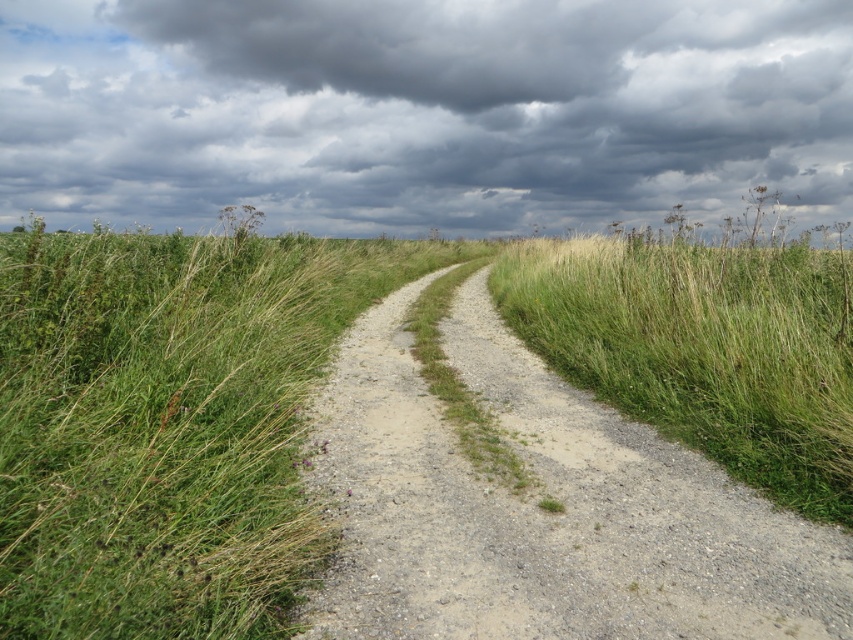
Question: Among these objects, which one is farthest from the camera?

Choices:
 (A) dark gray cloud at upper center
 (B) dusty gravel path at center

Answer: (A)

Question: Which of the following is the closest to the observer?

Choices:
 (A) (700, 125)
 (B) (704, 483)

Answer: (B)

Question: Is dark gray cloud at upper center wider than dusty gravel path at center?

Choices:
 (A) yes
 (B) no

Answer: (A)

Question: Which point appears closest to the camera in this image?

Choices:
 (A) (262, 202)
 (B) (462, 308)

Answer: (B)

Question: Where is dark gray cloud at upper center located in relation to dusty gravel path at center in the image?

Choices:
 (A) above
 (B) below

Answer: (A)

Question: In this image, where is dark gray cloud at upper center located relative to dusty gravel path at center?

Choices:
 (A) left
 (B) right

Answer: (A)